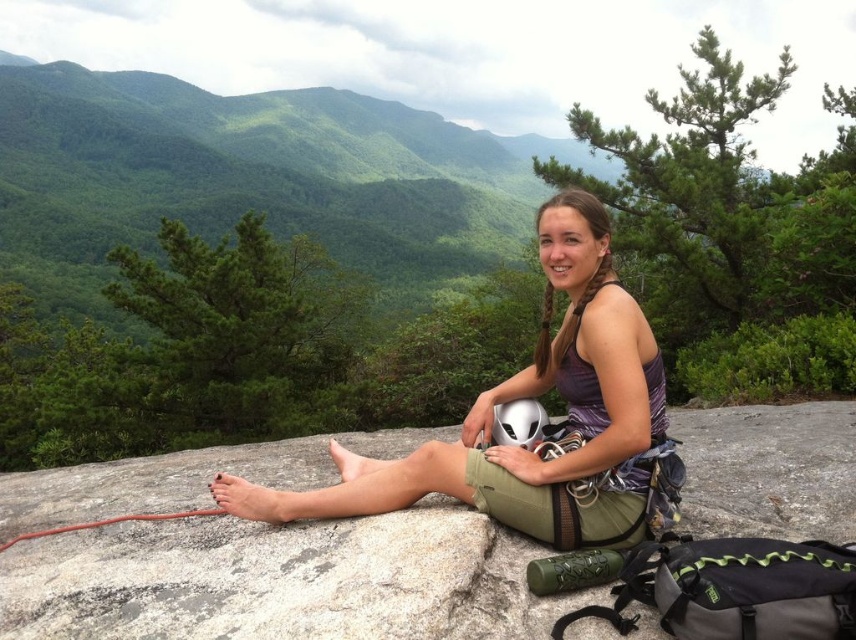
You are a photographer standing 1 meter away from the person in the image. You want to capture a closeup shot of both the matte purple tank top at center and the white matte helmet at center in the same frame. Considering your camera has a maximum focus range of 50 centimeters, will you be able to include both objects in the shot without moving closer?

The distance between the matte purple tank top at center and the white matte helmet at center is 41.33 centimeters. Since the camera can focus up to 50 centimeters, both objects can fit within the focus range. Therefore, you can capture both in the same frame without moving closer.

You are an outdoor enthusiast planning to place a new camping gear bag next to the green fabric boulder at center and the matte purple tank top at center. Which object should you place the gear bag next to if you want it to be near the smaller item?

The green fabric boulder at center is smaller than the matte purple tank top at center, so you should place the gear bag next to the green fabric boulder at center.

You are a photographer trying to capture the person in the scene. You want to ensure both the matte purple tank top at center and the white matte helmet at center are clearly visible in your shot. Which object should you focus on first to ensure depth of field captures both?

The matte purple tank top at center is closer to the viewer than the white matte helmet at center. To ensure both are in focus, focus on the matte purple tank top at center first since it is closer, allowing the depth of field to extend backward to the helmet.